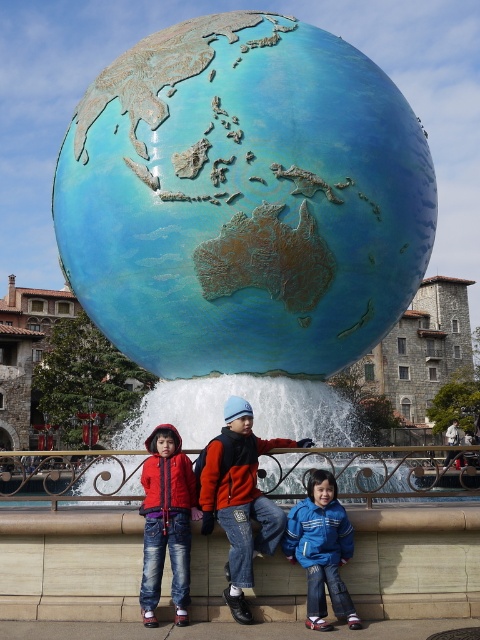
Which of these two, matte blue beanie at center or blue fleece jacket at lower right, stands shorter?

blue fleece jacket at lower right is shorter.

This screenshot has width=480, height=640. Find the location of `matte blue beanie at center`. matte blue beanie at center is located at coordinates (239, 497).

Locate an element on the screen. The image size is (480, 640). matte blue beanie at center is located at coordinates (239, 497).

Consider the image. Who is more forward, (201, 611) or (181, 464)?

Point (201, 611)

Is smooth stone ledge at lower center below denim jacket at lower left?

Yes.

Locate an element on the screen. The width and height of the screenshot is (480, 640). smooth stone ledge at lower center is located at coordinates (70, 564).

Between matte blue beanie at center and denim jacket at lower left, which one appears on the left side from the viewer's perspective?

denim jacket at lower left

Which is in front, point (247, 403) or point (152, 596)?

Point (152, 596)

Where is `matte blue beanie at center`? matte blue beanie at center is located at coordinates (239, 497).